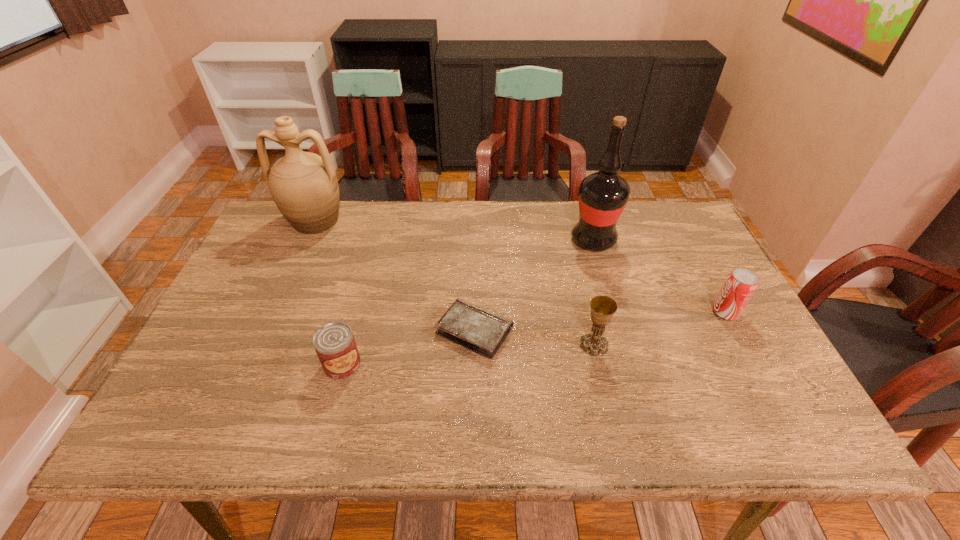
Image resolution: width=960 pixels, height=540 pixels. Identify the location of object that is at the far left corner. click(x=303, y=185).

Find the location of a particular element. Image resolution: width=960 pixels, height=540 pixels. vacant region at the far edge of the desktop is located at coordinates (348, 231).

Locate an element on the screen. This screenshot has height=540, width=960. vacant space at the near edge of the desktop is located at coordinates (322, 413).

In the image, there is a desktop. Where is `vacant space at the left edge`? vacant space at the left edge is located at coordinates (261, 253).

Identify the location of blank area at the right edge. (736, 348).

Find the location of a particular element. blank area at the far left corner is located at coordinates (300, 245).

You are a GUI agent. You are given a task and a screenshot of the screen. Output one action in this format:
    pyautogui.click(x=<x>, y=<y>)
    Task: Click on the free space that is in between the diary and the chalice
    The width and height of the screenshot is (960, 540).
    Given the screenshot: What is the action you would take?
    pyautogui.click(x=534, y=338)

You are a GUI agent. You are given a task and a screenshot of the screen. Output one action in this format:
    pyautogui.click(x=<x>, y=<y>)
    Task: Click on the unoccupied area between the wine bottle and the chalice
    The image size is (960, 540).
    Given the screenshot: What is the action you would take?
    pyautogui.click(x=593, y=293)

Where is `free space that is in between the chalice and the rightmost object`? This screenshot has width=960, height=540. free space that is in between the chalice and the rightmost object is located at coordinates (660, 328).

In order to click on vacant space that is in between the second shortest object and the chalice in this screenshot , I will do `click(468, 355)`.